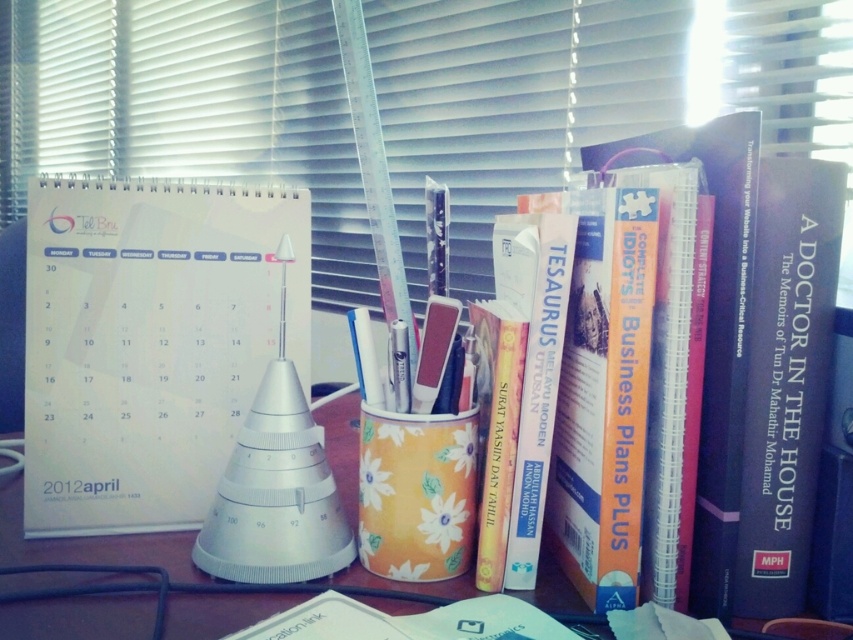
Question: Which of the following is the closest to the observer?

Choices:
 (A) white paper calendar at center
 (B) hardcover book at center
 (C) blue hardcover book at right
 (D) white plastic ruler at upper center

Answer: (B)

Question: Which object is farther from the camera taking this photo?

Choices:
 (A) hardcover book at center
 (B) blue hardcover book at right

Answer: (B)

Question: Is white plastic ruler at upper center further to the viewer compared to yellow floral-patterned cup at center?

Choices:
 (A) yes
 (B) no

Answer: (A)

Question: Which object is farther from the camera taking this photo?

Choices:
 (A) yellow floral-patterned cup at center
 (B) brown wooden table at center
 (C) white paper calendar at center

Answer: (C)

Question: Does white paper calendar at center appear over hardcover book at center?

Choices:
 (A) yes
 (B) no

Answer: (B)

Question: Is white plastic ruler at upper center below brown wooden table at center?

Choices:
 (A) yes
 (B) no

Answer: (B)